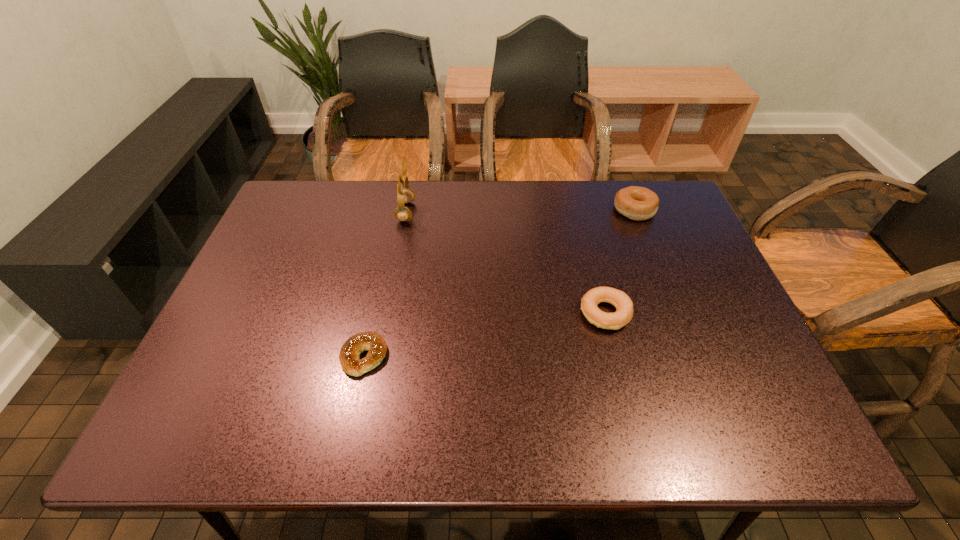
Locate an element on the screen. The height and width of the screenshot is (540, 960). the tallest object is located at coordinates (404, 195).

The width and height of the screenshot is (960, 540). Identify the location of the rightmost object. (637, 203).

Where is `the second tallest object`? the second tallest object is located at coordinates (637, 203).

Where is `the second bagel from right to left`? the second bagel from right to left is located at coordinates (621, 301).

Identify the location of the second farthest bagel. (621, 301).

The height and width of the screenshot is (540, 960). I want to click on the nearest object, so click(x=374, y=343).

Locate an element on the screen. This screenshot has height=540, width=960. the nearest bagel is located at coordinates (374, 343).

This screenshot has height=540, width=960. What are the coordinates of `vacant space located 0.160m on the front-facing side of the earphone` in the screenshot? It's located at [x=467, y=212].

Locate an element on the screen. This screenshot has height=540, width=960. vacant point located on the front of the rightmost bagel is located at coordinates (672, 306).

Locate an element on the screen. free point located on the front of the third object from left to right is located at coordinates (617, 363).